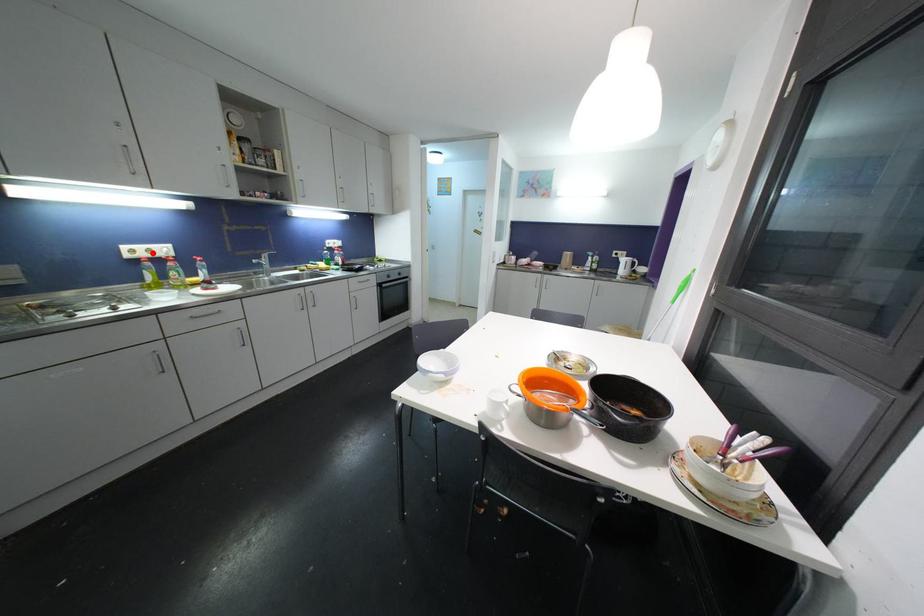
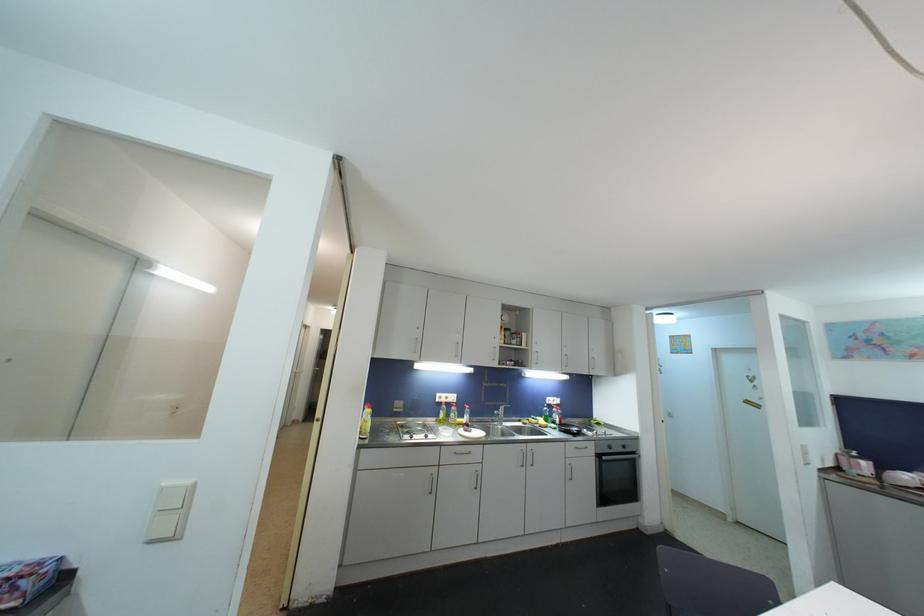
Question: I am providing you with two images of the same scene from different viewpoints. Given a red point in image1, look at the same physical point in image2. Is it:

Choices:
 (A) Closer to the viewpoint
 (B) Farther from the viewpoint

Answer: (B)